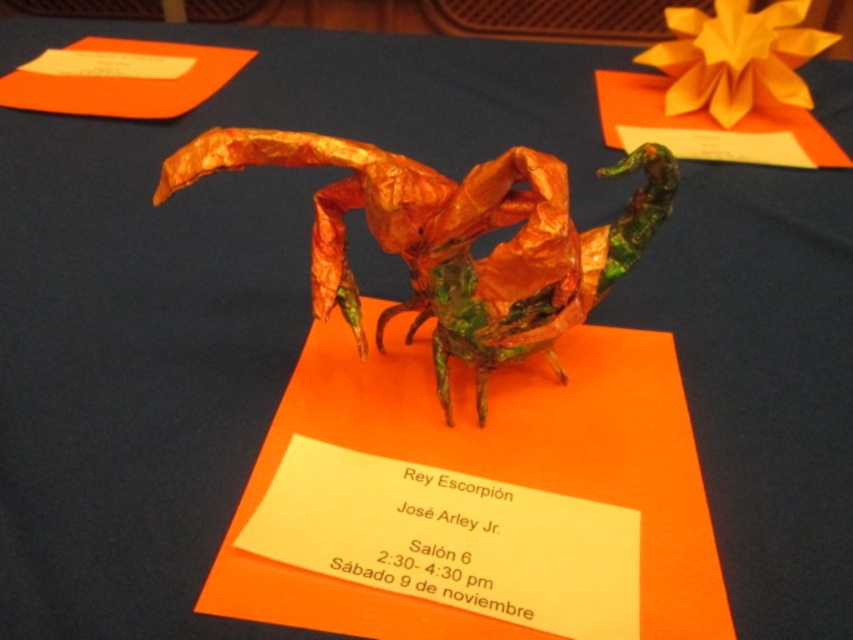
The height and width of the screenshot is (640, 853). I want to click on metallic orange scorpion at center, so click(454, 240).

Is point (190, 152) behind point (634, 58)?

That is False.

Identify the location of metallic orange scorpion at center. 454,240.

Image resolution: width=853 pixels, height=640 pixels. In order to click on metallic orange scorpion at center in this screenshot , I will do `click(454, 240)`.